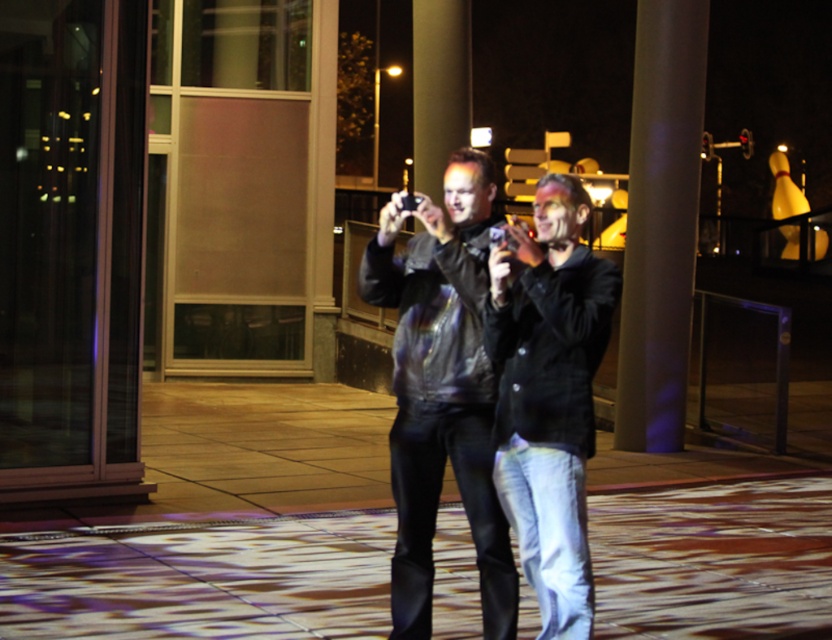
You are a photographer trying to decide where to stand to capture both the denim jeans at center and the shiny black jacket at center in your shot. Based on their heights, which one might appear larger in the photo?

The shiny black jacket at center appears taller than the denim jeans at center, so it would likely look larger in the photo.

You are standing at the point with coordinates point (572, 248) and want to walk towards point (347, 292). Given the scene, what direction should you move?

Since point (572, 248) is in front of point (347, 292), you should move backward to reach point (347, 292).